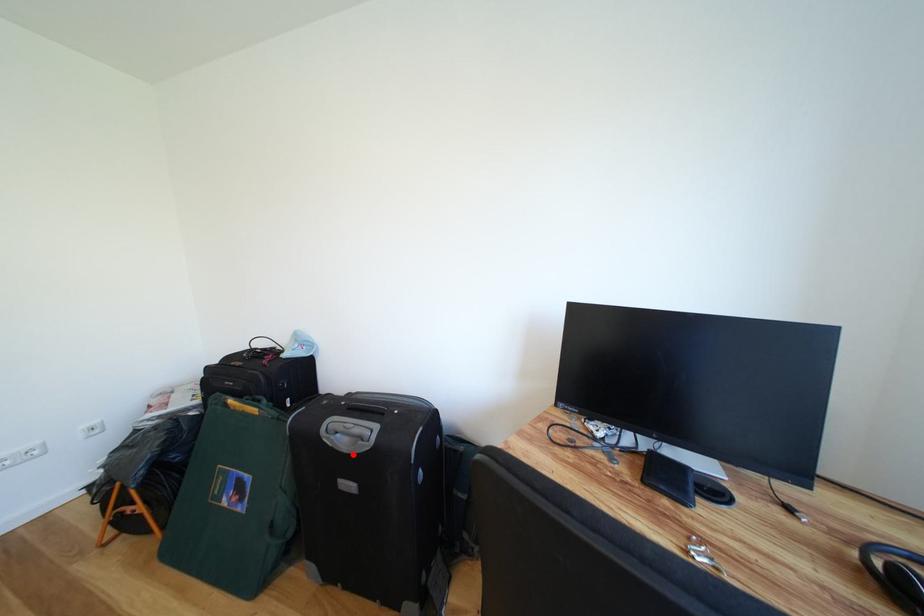
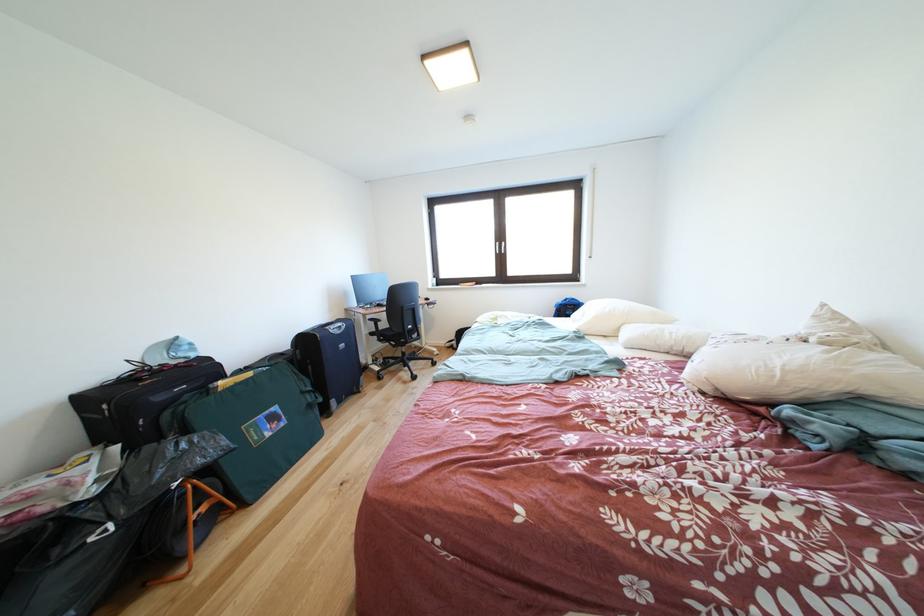
In the second image, find the point that corresponds to the highlighted location in the first image.

(347, 337)